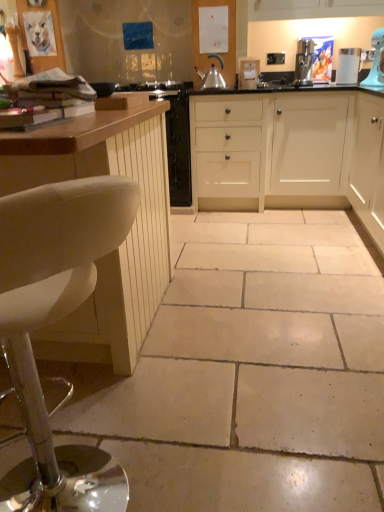
Find the location of a particular element. The image size is (384, 512). white leather stool at left is located at coordinates (52, 322).

What do you see at coordinates (52, 322) in the screenshot? I see `white leather stool at left` at bounding box center [52, 322].

What do you see at coordinates (304, 62) in the screenshot?
I see `metallic stainless steel coffee maker at upper right, which is counted as the 2th kitchen appliance, starting from the left` at bounding box center [304, 62].

Find the location of `metallic stainless steel coffee maker at upper right, which is counted as the 2th kitchen appliance, starting from the left`. metallic stainless steel coffee maker at upper right, which is counted as the 2th kitchen appliance, starting from the left is located at coordinates [304, 62].

Where is `white wood cabinet at left, marked as the first cabinetry in a left-to-right arrangement`? This screenshot has width=384, height=512. white wood cabinet at left, marked as the first cabinetry in a left-to-right arrangement is located at coordinates (122, 244).

What do you see at coordinates (376, 61) in the screenshot? This screenshot has height=512, width=384. I see `blue plastic stand mixer at upper right` at bounding box center [376, 61].

The width and height of the screenshot is (384, 512). I want to click on white glossy coffee maker at upper right, so click(x=348, y=65).

This screenshot has width=384, height=512. What do you see at coordinates (252, 371) in the screenshot?
I see `beige tile floor at center` at bounding box center [252, 371].

The width and height of the screenshot is (384, 512). I want to click on white leather stool at left, so click(52, 322).

Looking at this image, between white matte cabinet at right, the 3th cabinetry from the left, and white leather stool at left, which one has smaller width?

Thinner between the two is white matte cabinet at right, the 3th cabinetry from the left.

From a real-world perspective, is white matte cabinet at right, the 3th cabinetry from the left, beneath white leather stool at left?

No, from a real-world perspective, white matte cabinet at right, the 3th cabinetry from the left, is not under white leather stool at left.

Is white matte cabinet at right, marked as the first cabinetry in a right-to-left arrangement, turned away from white leather stool at left?

No.

Does white matte cabinet at right, the 3th cabinetry from the left, appear on the right side of white leather stool at left?

Yes, white matte cabinet at right, the 3th cabinetry from the left, is to the right of white leather stool at left.

Which of these two, white wood cabinet at left, marked as the first cabinetry in a left-to-right arrangement, or white glossy coffee maker at upper right, is thinner?

white glossy coffee maker at upper right.

Which of these two, white wood cabinet at left, marked as the first cabinetry in a left-to-right arrangement, or white glossy coffee maker at upper right, is smaller?

Smaller between the two is white glossy coffee maker at upper right.

Looking at this image, is the depth of white wood cabinet at left, marked as the first cabinetry in a left-to-right arrangement, less than that of white glossy coffee maker at upper right?

Yes, white wood cabinet at left, marked as the first cabinetry in a left-to-right arrangement, is closer to the viewer.

From a real-world perspective, which object stands above the other?

white glossy coffee maker at upper right is physically above.

Is white leather stool at left next to white wood cabinet at left, marked as the first cabinetry in a left-to-right arrangement?

No, white leather stool at left is not touching white wood cabinet at left, marked as the first cabinetry in a left-to-right arrangement.

Considering the relative sizes of white leather stool at left and white wood cabinet at left, marked as the first cabinetry in a left-to-right arrangement, in the image provided, is white leather stool at left thinner than white wood cabinet at left, marked as the first cabinetry in a left-to-right arrangement,?

Yes.

Considering the relative sizes of white leather stool at left and white wood cabinet at left, marked as the first cabinetry in a left-to-right arrangement, in the image provided, is white leather stool at left shorter than white wood cabinet at left, marked as the first cabinetry in a left-to-right arrangement,?

Yes.

From a real-world perspective, is white matte cabinet at right, marked as the first cabinetry in a right-to-left arrangement, positioned above or below beige tile floor at center?

In terms of real-world spatial position, white matte cabinet at right, marked as the first cabinetry in a right-to-left arrangement, is above beige tile floor at center.

What's the angular difference between white matte cabinet at right, marked as the first cabinetry in a right-to-left arrangement, and beige tile floor at center's facing directions?

They differ by 89.2 degrees in their facing directions.

Image resolution: width=384 pixels, height=512 pixels. In order to click on cabinetry that is the 2nd one above the beige tile floor at center (from a real-world perspective) in this screenshot , I will do `click(368, 166)`.

Considering the relative positions of white matte cabinet at right, the 3th cabinetry from the left, and beige tile floor at center in the image provided, is white matte cabinet at right, the 3th cabinetry from the left, to the left or to the right of beige tile floor at center?

white matte cabinet at right, the 3th cabinetry from the left, is positioned on beige tile floor at center's right side.

Considering the sizes of objects metallic stainless steel coffee maker at upper right, placed as the 1th kitchen appliance when sorted from right to left, and beige tile floor at center in the image provided, who is wider, metallic stainless steel coffee maker at upper right, placed as the 1th kitchen appliance when sorted from right to left, or beige tile floor at center?

Wider between the two is beige tile floor at center.

From a real-world perspective, is metallic stainless steel coffee maker at upper right, which is counted as the 2th kitchen appliance, starting from the left, above or below beige tile floor at center?

Clearly, from a real-world perspective, metallic stainless steel coffee maker at upper right, which is counted as the 2th kitchen appliance, starting from the left, is above beige tile floor at center.

Is metallic stainless steel coffee maker at upper right, which is counted as the 2th kitchen appliance, starting from the left, to the left of beige tile floor at center from the viewer's perspective?

No.

Is metallic stainless steel coffee maker at upper right, placed as the 1th kitchen appliance when sorted from right to left, oriented towards beige tile floor at center?

No, metallic stainless steel coffee maker at upper right, placed as the 1th kitchen appliance when sorted from right to left, is not facing towards beige tile floor at center.

From the image's perspective, relative to white glossy coffee maker at upper right, is beige tile floor at center above or below?

beige tile floor at center is below white glossy coffee maker at upper right.

What's the angular difference between beige tile floor at center and white glossy coffee maker at upper right's facing directions?

beige tile floor at center and white glossy coffee maker at upper right are facing 0.8 degrees away from each other.

Considering the sizes of objects beige tile floor at center and white glossy coffee maker at upper right in the image provided, who is wider, beige tile floor at center or white glossy coffee maker at upper right?

With larger width is beige tile floor at center.

Is the surface of beige tile floor at center in direct contact with white glossy coffee maker at upper right?

beige tile floor at center is not next to white glossy coffee maker at upper right, and they're not touching.

Considering the sizes of objects blue plastic stand mixer at upper right and white matte cabinet at right, marked as the first cabinetry in a right-to-left arrangement, in the image provided, who is shorter, blue plastic stand mixer at upper right or white matte cabinet at right, marked as the first cabinetry in a right-to-left arrangement,?

blue plastic stand mixer at upper right is shorter.

This screenshot has width=384, height=512. What are the coordinates of `cabinetry that is the 1st one when counting leftward from the blue plastic stand mixer at upper right` in the screenshot? It's located at point(368,166).

From the image's perspective, count 2nd cabinetrys upward from the white leather stool at left and point to it. Please provide its 2D coordinates.

[(368, 166)]

At what (x,y) coordinates should I click in order to perform the action: click on appliance that appears above the white wood cabinet at left, the 3th cabinetry when ordered from right to left (from a real-world perspective). Please return your answer as a coordinate pair (x, y). The width and height of the screenshot is (384, 512). Looking at the image, I should click on (348, 65).

Estimate the real-world distances between objects in this image. Which object is further from blue plastic stand mixer at upper right, white glossy coffee maker at upper right or metallic stainless steel coffee maker at upper right, which is counted as the 2th kitchen appliance, starting from the left?

metallic stainless steel coffee maker at upper right, which is counted as the 2th kitchen appliance, starting from the left, is positioned further to the anchor blue plastic stand mixer at upper right.

Based on their spatial positions, is white wood cabinet at left, marked as the first cabinetry in a left-to-right arrangement, or satin silver kettle at center, which is counted as the first kitchen appliance, starting from the left, further from white matte cabinet at center, marked as the 2th cabinetry in a left-to-right arrangement?

white wood cabinet at left, marked as the first cabinetry in a left-to-right arrangement, is further to white matte cabinet at center, marked as the 2th cabinetry in a left-to-right arrangement.

When comparing their distances from white glossy coffee maker at upper right, does blue plastic stand mixer at upper right or metallic stainless steel coffee maker at upper right, which is counted as the 2th kitchen appliance, starting from the left, seem closer?

The object closer to white glossy coffee maker at upper right is blue plastic stand mixer at upper right.

When comparing their distances from satin silver kettle at center, which is the second kitchen appliance in right-to-left order, does metallic stainless steel coffee maker at upper right, which is counted as the 2th kitchen appliance, starting from the left, or white matte cabinet at center, marked as the 2th cabinetry in a left-to-right arrangement, seem closer?

metallic stainless steel coffee maker at upper right, which is counted as the 2th kitchen appliance, starting from the left, lies closer to satin silver kettle at center, which is the second kitchen appliance in right-to-left order, than the other object.

Considering their positions, is white matte cabinet at center, the second cabinetry when ordered from right to left, positioned further to white glossy coffee maker at upper right than beige tile floor at center?

Based on the image, beige tile floor at center appears to be further to white glossy coffee maker at upper right.

Based on the photo, which object lies nearer to the anchor point white matte cabinet at center, the second cabinetry when ordered from right to left, satin silver kettle at center, which is counted as the first kitchen appliance, starting from the left, or white matte cabinet at right, the 3th cabinetry from the left?

white matte cabinet at right, the 3th cabinetry from the left.

In the scene shown: Estimate the real-world distances between objects in this image. Which object is closer to metallic stainless steel coffee maker at upper right, which is counted as the 2th kitchen appliance, starting from the left, white leather stool at left or beige tile floor at center?

A: beige tile floor at center is positioned closer to the anchor metallic stainless steel coffee maker at upper right, which is counted as the 2th kitchen appliance, starting from the left.

Considering their positions, is white leather stool at left positioned further to beige tile floor at center than metallic stainless steel coffee maker at upper right, which is counted as the 2th kitchen appliance, starting from the left?

metallic stainless steel coffee maker at upper right, which is counted as the 2th kitchen appliance, starting from the left, is positioned further to the anchor beige tile floor at center.

Where is `cabinetry between white wood cabinet at left, marked as the first cabinetry in a left-to-right arrangement, and white matte cabinet at right, marked as the first cabinetry in a right-to-left arrangement`? cabinetry between white wood cabinet at left, marked as the first cabinetry in a left-to-right arrangement, and white matte cabinet at right, marked as the first cabinetry in a right-to-left arrangement is located at coordinates (291, 151).

At what (x,y) coordinates should I click in order to perform the action: click on concrete between white wood cabinet at left, the 3th cabinetry when ordered from right to left, and white matte cabinet at right, marked as the first cabinetry in a right-to-left arrangement, in the horizontal direction. Please return your answer as a coordinate pair (x, y). This screenshot has height=512, width=384. Looking at the image, I should click on click(252, 371).

I want to click on kitchen appliance positioned between white matte cabinet at right, marked as the first cabinetry in a right-to-left arrangement, and satin silver kettle at center, which is counted as the first kitchen appliance, starting from the left, from near to far, so click(x=304, y=62).

Locate an element on the screen. The width and height of the screenshot is (384, 512). concrete between white wood cabinet at left, the 3th cabinetry when ordered from right to left, and blue plastic stand mixer at upper right is located at coordinates (252, 371).